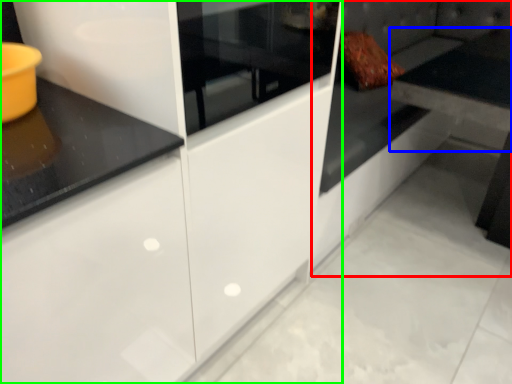
Question: Based on their relative distances, which object is farther from couch (highlighted by a red box)? Choose from table (highlighted by a blue box) and cabinetry (highlighted by a green box).

Choices:
 (A) table
 (B) cabinetry

Answer: (A)